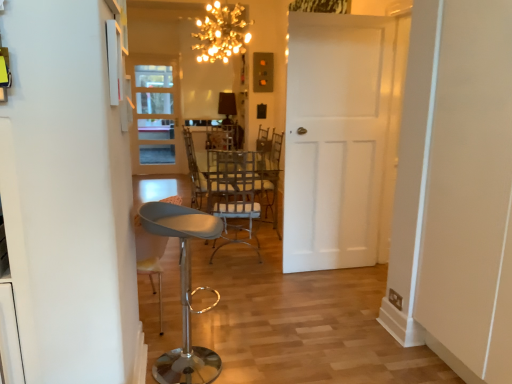
Question: Looking at the image, does metallic woven chair at center seem bigger or smaller compared to metallic silver chair at center?

Choices:
 (A) small
 (B) big

Answer: (A)

Question: Considering the positions of metallic woven chair at center and metallic silver chair at center in the image, is metallic woven chair at center wider or thinner than metallic silver chair at center?

Choices:
 (A) wide
 (B) thin

Answer: (A)

Question: Which object is positioned closest to the metallic woven chair at center?

Choices:
 (A) gold metallic chandelier at upper center
 (B) white matte door at center, acting as the second door starting from the left
 (C) metallic gray stool at lower left
 (D) metallic silver chair at center
 (E) white glass door at left, which is counted as the 1th door, starting from the back

Answer: (D)

Question: Which is nearer to the metallic gray stool at lower left?

Choices:
 (A) metallic woven chair at center
 (B) gold metallic chandelier at upper center
 (C) white glass door at left, which is counted as the 1th door, starting from the back
 (D) white matte door at center, placed as the first door when sorted from right to left
 (E) metallic silver chair at center

Answer: (E)